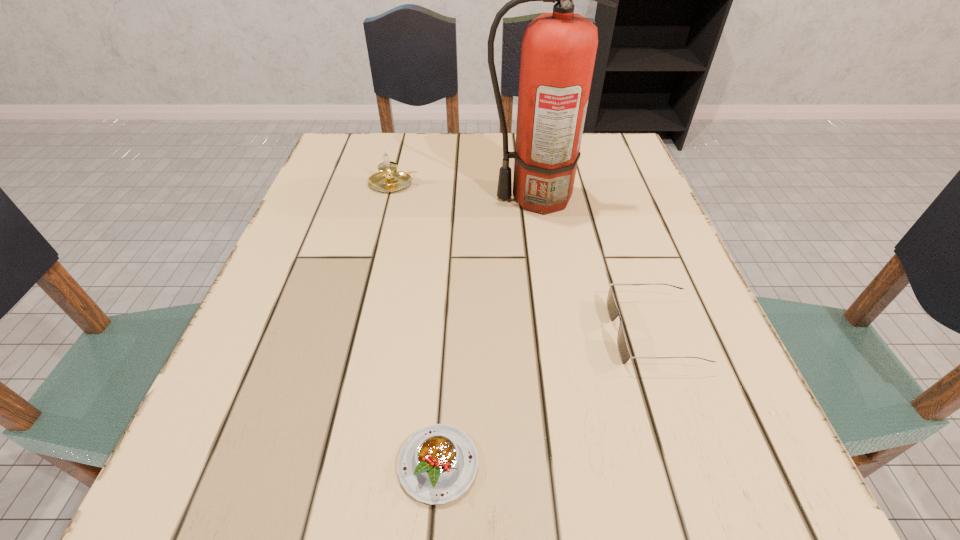
Identify the location of fire extinguisher. This screenshot has width=960, height=540. (558, 50).

In order to click on candle holder in this screenshot , I will do `click(386, 180)`.

At what (x,y) coordinates should I click in order to perform the action: click on the second tallest object. Please return your answer as a coordinate pair (x, y). The image size is (960, 540). Looking at the image, I should click on (386, 180).

Image resolution: width=960 pixels, height=540 pixels. Identify the location of the second nearest object. (613, 312).

Locate an element on the screen. The height and width of the screenshot is (540, 960). the third object from right to left is located at coordinates (437, 464).

The height and width of the screenshot is (540, 960). I want to click on pudding, so click(x=437, y=464).

You are a GUI agent. You are given a task and a screenshot of the screen. Output one action in this format:
    pyautogui.click(x=<x>, y=<y>)
    Task: Click on the blank area located on the nozzle of the tallest object
    
    Given the screenshot: What is the action you would take?
    pyautogui.click(x=311, y=198)

Locate an element on the screen. This screenshot has width=960, height=540. free spot located on the nozzle of the tallest object is located at coordinates (369, 198).

Where is `vacant area located 0.160m on the nozzle of the tallest object`? vacant area located 0.160m on the nozzle of the tallest object is located at coordinates (414, 198).

Find the location of a particular element. The image size is (960, 540). blank space located 0.340m on the handle side of the candle holder is located at coordinates (565, 184).